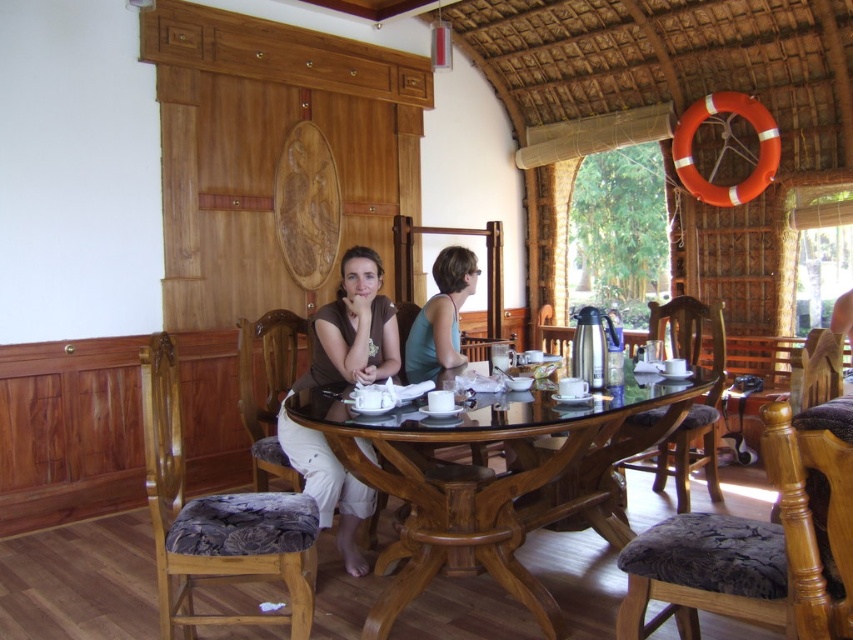
You are standing at the entrance of the dining area. There is a point marked at coordinates (496, 480). What object is located at that point?

The point at coordinates (496, 480) marks the location of the mahogany wood table at center.

You are a guest at a dinner party and need to sit down. You see the mahogany wood table at center and the brown fabric pants at center. Which object should you approach to find a place to sit?

The brown fabric pants at center is where you should sit since it is a piece of furniture designed for sitting, unlike the mahogany wood table at center which is meant for placing items.

You are a guest entering the dining area and want to sit down. You see the mahogany wood table at center and the brown fabric pants at center. Which object should you approach first to find a seat?

The brown fabric pants at center are located to the left of the mahogany wood table at center, so you should approach the brown fabric pants at center first to find a seat.